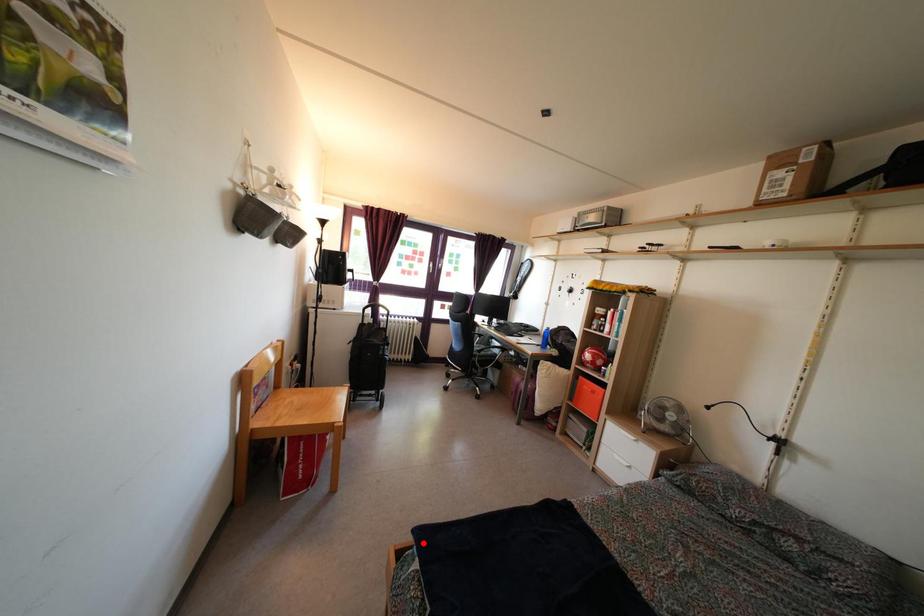
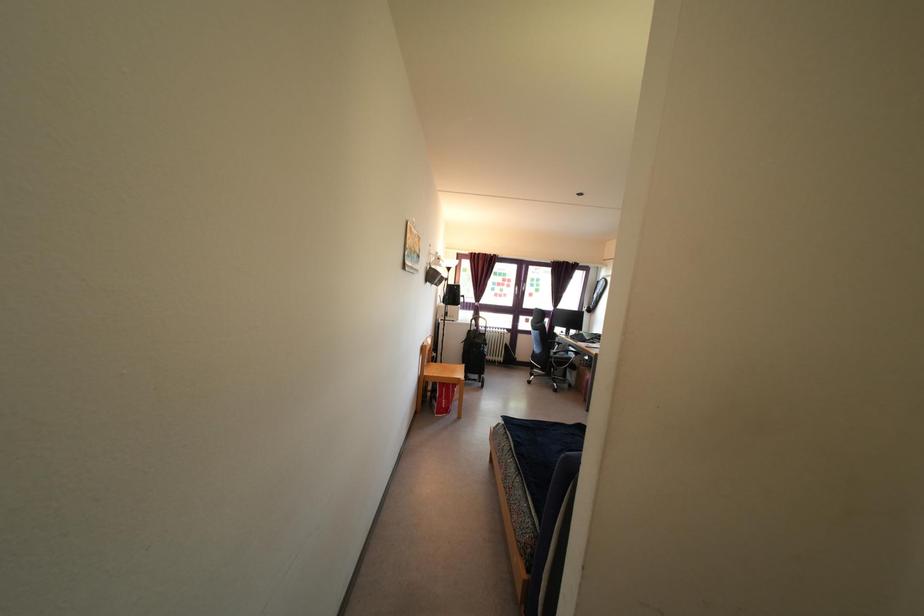
Where in the second image is the point corresponding to the highlighted location from the first image?

(507, 427)